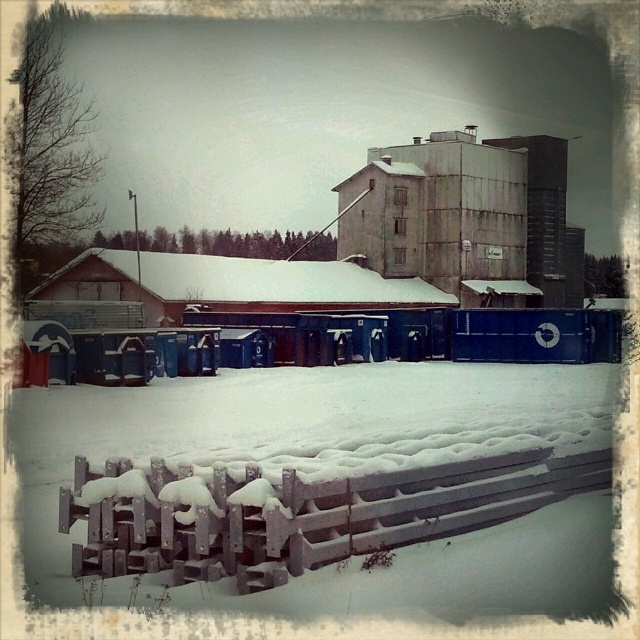
Can you confirm if wooden snow-covered fence at lower center is shorter than rusty metal building at center?

Indeed, wooden snow-covered fence at lower center has a lesser height compared to rusty metal building at center.

Which is more to the right, wooden snow-covered fence at lower center or rusty metal building at center?

From the viewer's perspective, rusty metal building at center appears more on the right side.

This screenshot has height=640, width=640. What are the coordinates of `wooden snow-covered fence at lower center` in the screenshot? It's located at (310, 515).

At what (x,y) coordinates should I click in order to perform the action: click on wooden snow-covered fence at lower center. Please return your answer as a coordinate pair (x, y). The image size is (640, 640). Looking at the image, I should click on (310, 515).

Can you confirm if rusty metal building at center is smaller than snow-covered wooden barn at center?

Actually, rusty metal building at center might be larger than snow-covered wooden barn at center.

Which is in front, point (468, 268) or point (177, 308)?

Point (177, 308) is in front.

Identify the location of rusty metal building at center. (442, 218).

Looking at this image, does wooden snow-covered fence at lower center appear under snow-covered wooden barn at center?

Yes, wooden snow-covered fence at lower center is below snow-covered wooden barn at center.

Does wooden snow-covered fence at lower center have a greater width compared to snow-covered wooden barn at center?

No, wooden snow-covered fence at lower center is not wider than snow-covered wooden barn at center.

Identify the location of wooden snow-covered fence at lower center. This screenshot has width=640, height=640. pyautogui.click(x=310, y=515).